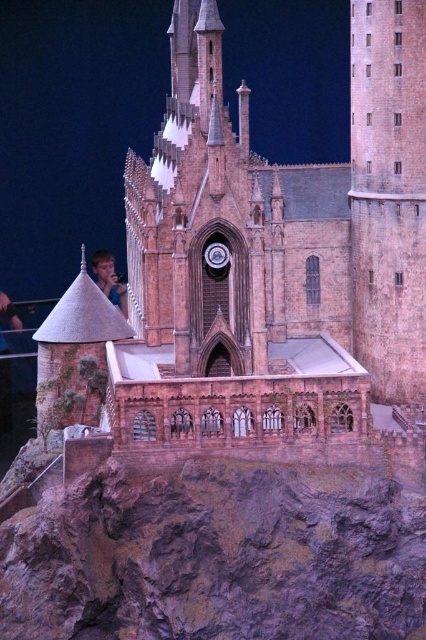
You are standing in front of the castle model and want to know how far the point labeled as point (x=198, y=1) is from your current position. Can you determine the distance?

The point labeled as point (x=198, y=1) is 368.35 feet away from the camera, so the distance from your current position to that point is 368.35 feet.

You are a visitor standing in front of the castle model and notice the brown brick church at center and the light brown hair at lower left. Which object is located higher up in the image?

The brown brick church at center is positioned over light brown hair at lower left, so it is higher up in the image.